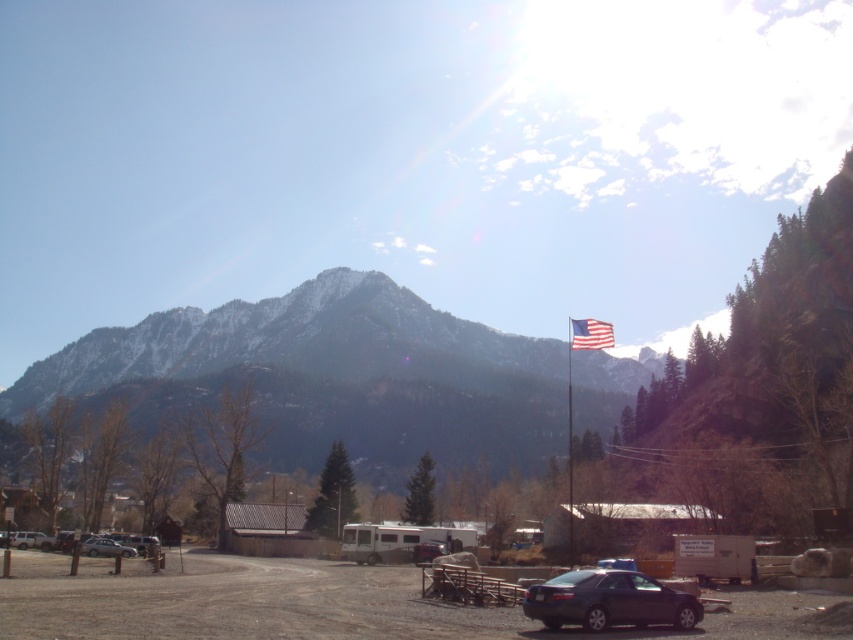
Question: Can you confirm if brown dirt track at lower center is positioned to the right of metallic flag pole at upper center?

Choices:
 (A) yes
 (B) no

Answer: (B)

Question: Which point appears closest to the camera in this image?

Choices:
 (A) (554, 614)
 (B) (587, 326)

Answer: (A)

Question: Estimate the real-world distances between objects in this image. Which object is closer to the metallic blue sedan at lower right?

Choices:
 (A) metallic silver car at center
 (B) brown dirt track at lower center

Answer: (B)

Question: Can you confirm if snowy rock mountain range at upper center is wider than metallic silver car at center?

Choices:
 (A) yes
 (B) no

Answer: (A)

Question: Which of the following is the closest to the observer?

Choices:
 (A) brown dirt track at lower center
 (B) metallic silver car at center
 (C) american flag at center
 (D) silver metallic sedan at lower left

Answer: (A)

Question: Is snowy rock mountain range at upper center thinner than brown dirt track at lower center?

Choices:
 (A) yes
 (B) no

Answer: (B)